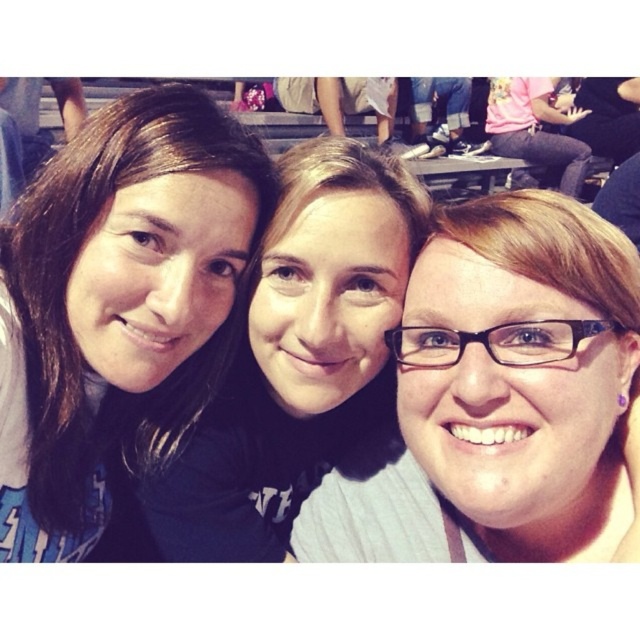
From the picture: Who is taller, brown hair at left or matte black shirt at center?

With more height is brown hair at left.

Between brown hair at left and matte black shirt at center, which one appears on the right side from the viewer's perspective?

matte black shirt at center is more to the right.

Who is more distant from viewer, (216,172) or (324,339)?

Point (216,172)

Where is `brown hair at left`? brown hair at left is located at coordinates (118, 307).

Between matte black glasses at center and matte black shirt at center, which one is positioned lower?

matte black glasses at center is lower down.

Can you confirm if matte black glasses at center is positioned to the right of matte black shirt at center?

Correct, you'll find matte black glasses at center to the right of matte black shirt at center.

Locate an element on the screen. This screenshot has width=640, height=640. matte black glasses at center is located at coordinates (502, 397).

Between brown hair at left and matte black glasses at center, which one is positioned higher?

brown hair at left is higher up.

Who is positioned more to the left, brown hair at left or matte black glasses at center?

brown hair at left is more to the left.

The height and width of the screenshot is (640, 640). Identify the location of brown hair at left. click(118, 307).